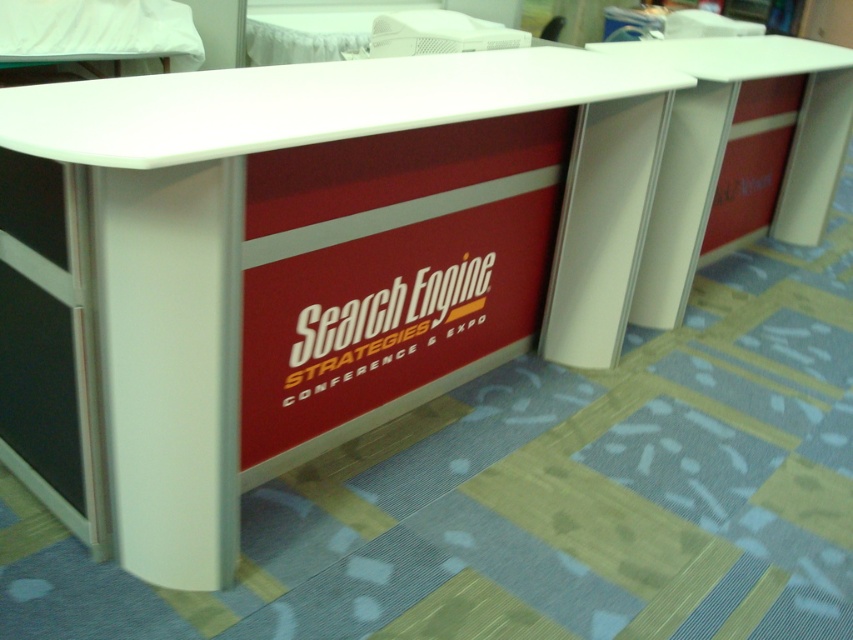
Question: Among these objects, which one is farthest from the camera?

Choices:
 (A) white glossy information desk at center
 (B) white plastic table at right

Answer: (B)

Question: Can you confirm if white glossy information desk at center is wider than white plastic table at right?

Choices:
 (A) no
 (B) yes

Answer: (B)

Question: Among these points, which one is farthest from the camera?

Choices:
 (A) (393, 292)
 (B) (778, 52)

Answer: (B)

Question: In this image, where is white glossy information desk at center located relative to white plastic table at right?

Choices:
 (A) left
 (B) right

Answer: (A)

Question: Can you confirm if white glossy information desk at center is positioned to the right of white plastic table at right?

Choices:
 (A) yes
 (B) no

Answer: (B)